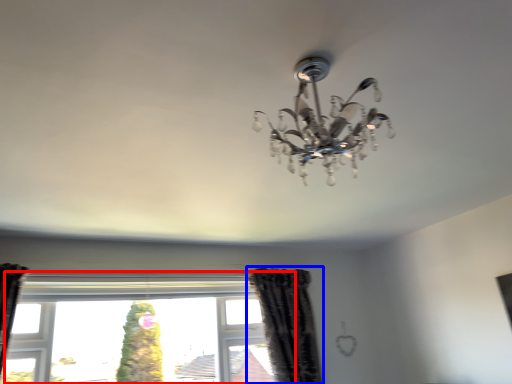
Question: Which of the following is the closest to the observer, window (highlighted by a red box) or curtain (highlighted by a blue box)?

Choices:
 (A) window
 (B) curtain

Answer: (A)